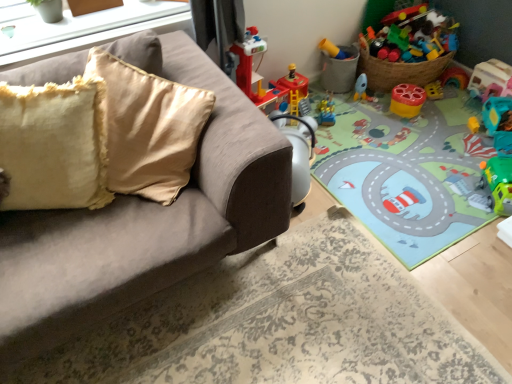
This screenshot has height=384, width=512. Find the location of `free space between translucent plastic toy car at upper right, which is the sixth toy in left-to-right order, and yellow plastic cup at center-right, acting as the 4th toy starting from the right`. free space between translucent plastic toy car at upper right, which is the sixth toy in left-to-right order, and yellow plastic cup at center-right, acting as the 4th toy starting from the right is located at coordinates (448, 104).